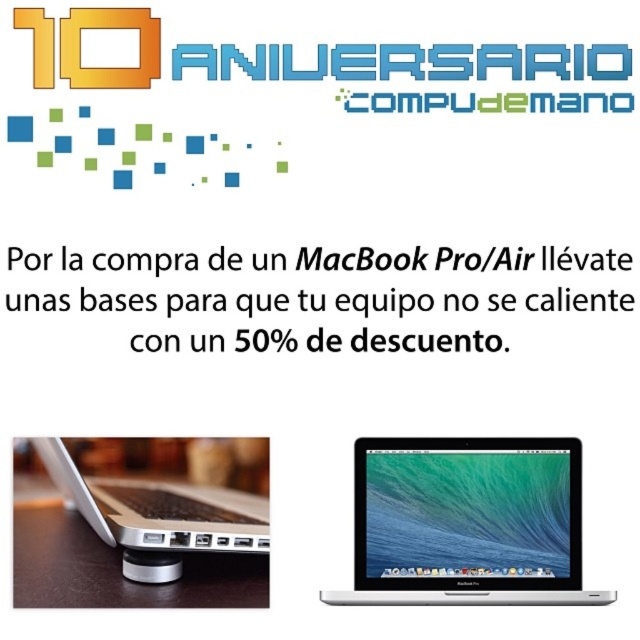
Question: Which point is farther to the camera?

Choices:
 (A) silver metallic laptop at lower left
 (B) silver metallic laptop at center

Answer: (B)

Question: Is silver metallic laptop at center below silver metallic laptop at lower left?

Choices:
 (A) no
 (B) yes

Answer: (B)

Question: Which of the following is the farthest from the observer?

Choices:
 (A) [108, 502]
 (B) [355, 582]

Answer: (A)

Question: Is silver metallic laptop at center positioned behind silver metallic laptop at lower left?

Choices:
 (A) yes
 (B) no

Answer: (A)

Question: Can you confirm if silver metallic laptop at center is positioned above silver metallic laptop at lower left?

Choices:
 (A) no
 (B) yes

Answer: (A)